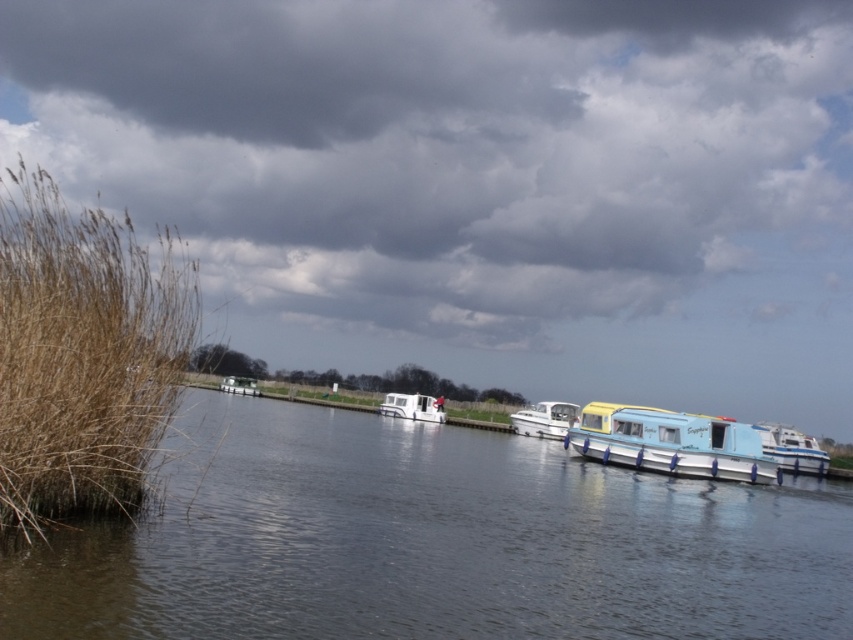
Question: Estimate the real-world distances between objects in this image. Which object is farther from the cloudy sky at upper center?

Choices:
 (A) dry grass at left
 (B) white glossy motorboat at center
 (C) white plastic boat at center

Answer: (C)

Question: Is white glossy motorboat at center smaller than white plastic boat at center?

Choices:
 (A) no
 (B) yes

Answer: (A)

Question: Estimate the real-world distances between objects in this image. Which object is closer to the white glossy motorboat at center?

Choices:
 (A) light blue plastic houseboat at center
 (B) white glossy boat at right
 (C) smooth water at lower left
 (D) white glossy boat at center

Answer: (D)

Question: Can you confirm if cloudy sky at upper center is positioned below light blue plastic houseboat at center?

Choices:
 (A) no
 (B) yes

Answer: (A)

Question: Which object appears closest to the camera in this image?

Choices:
 (A) white glossy boat at center
 (B) cloudy sky at upper center

Answer: (A)

Question: Does white glossy boat at right come behind white plastic boat at center?

Choices:
 (A) no
 (B) yes

Answer: (A)